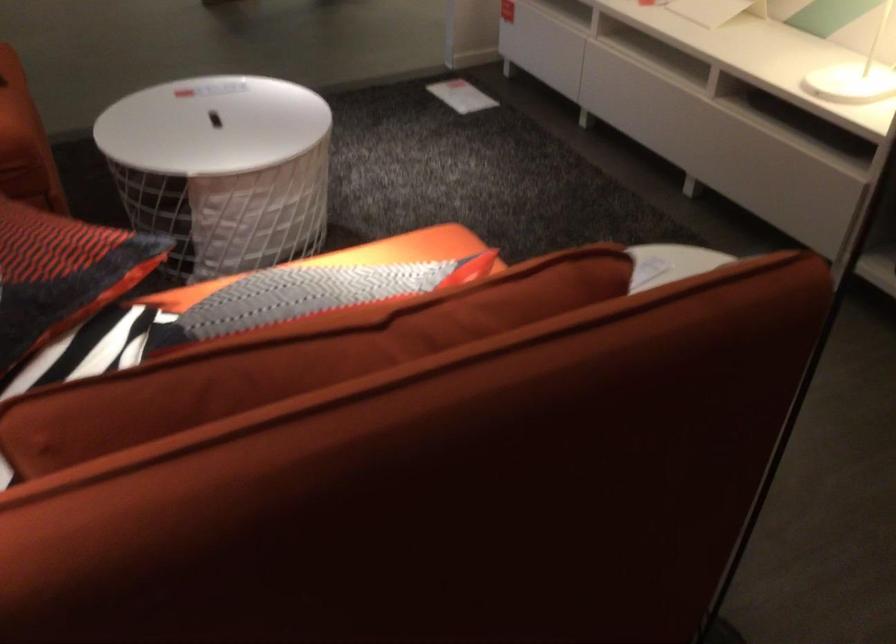
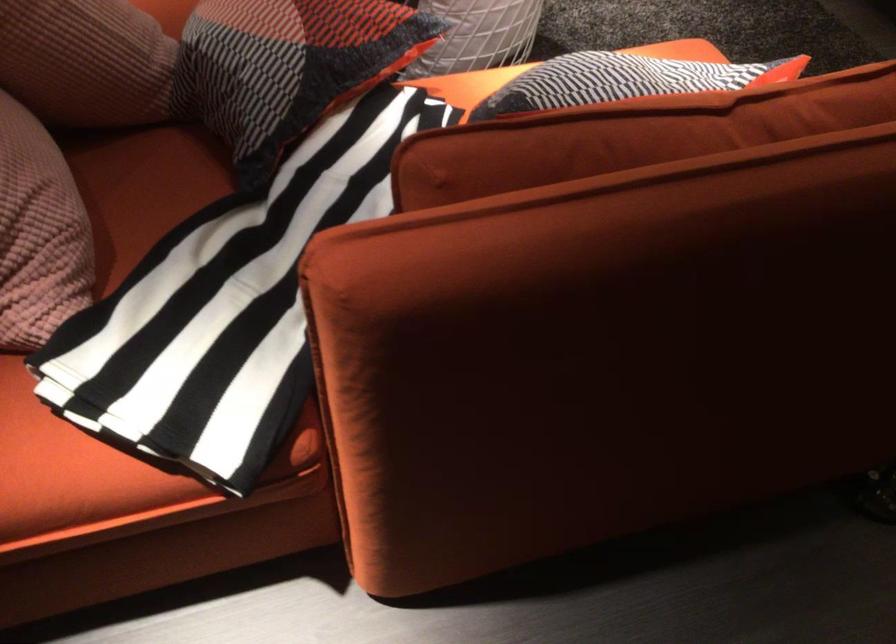
In a continuous first-person perspective shot, in which direction is the camera moving?

The cameraman walked toward left, backward.